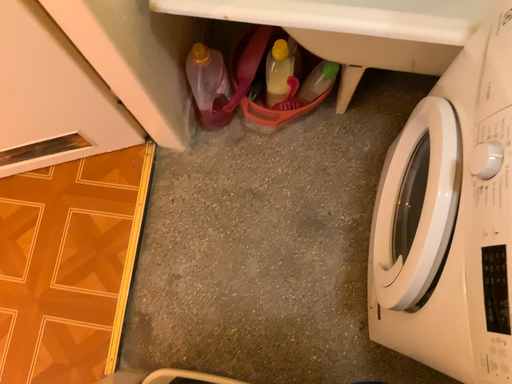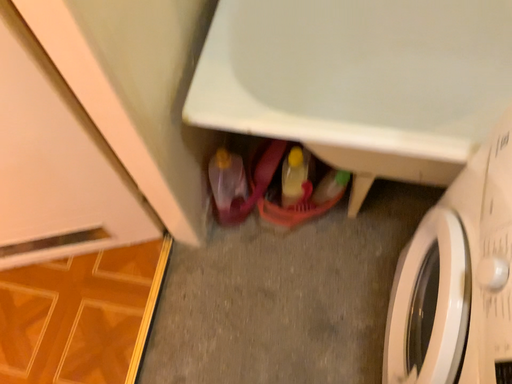
Question: Which way did the camera rotate in the video?

Choices:
 (A) rotated downward
 (B) rotated upward

Answer: (B)